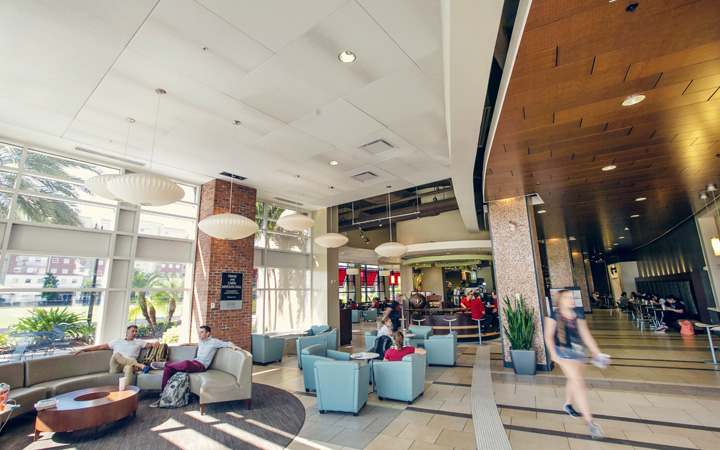
You are a GUI agent. You are given a task and a screenshot of the screen. Output one action in this format:
    pyautogui.click(x=<x>, y=<y>)
    Task: Click on the hanging lights
    The image size is (720, 450).
    Given the screenshot: What is the action you would take?
    pyautogui.click(x=153, y=191), pyautogui.click(x=228, y=223)